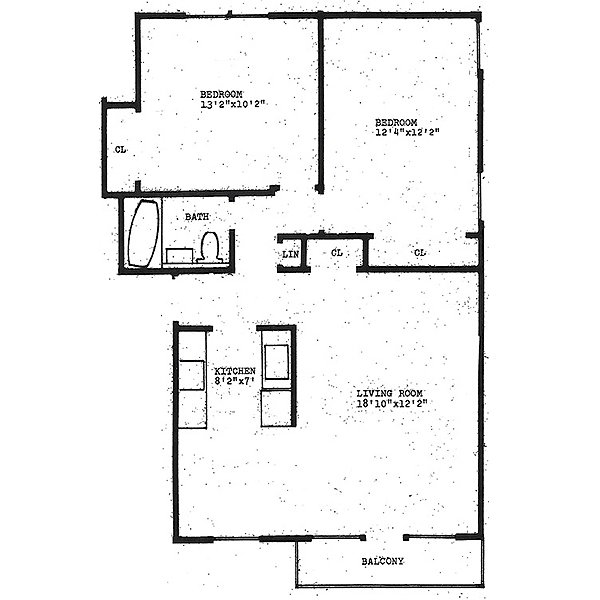
What are the coordinates of `largest room of the house` in the screenshot? It's located at tap(399, 391).